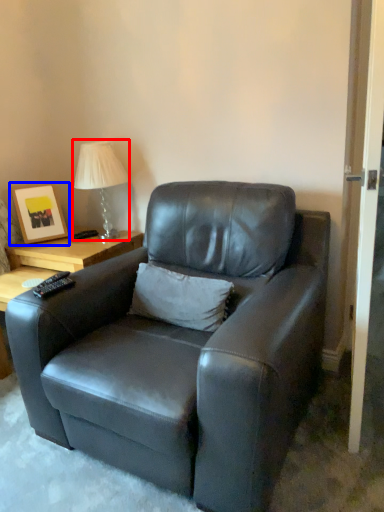
Question: Which object is closer to the camera taking this photo, table lamp (highlighted by a red box) or picture frame (highlighted by a blue box)?

Choices:
 (A) table lamp
 (B) picture frame

Answer: (A)